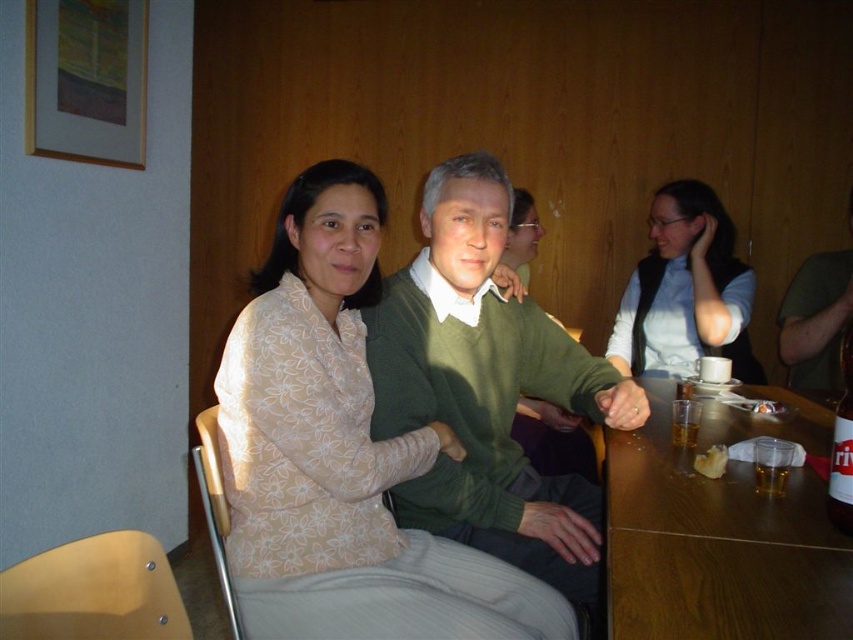
You are a photographer setting up for a group photo. You need to ensure that the green sweater at center and the white matte vest at upper right are both visible in the frame. Considering their sizes, which one might require more space horizontally to fit comfortably?

The green sweater at center requires more horizontal space because its width surpasses that of the white matte vest at upper right.

You are a photographer adjusting your camera settings to capture the scene. You notice the green sweater at center and the white matte vest at upper right. Which object should you focus on first to ensure both are in sharp focus?

The green sweater at center should be focused on first since it is in front of the white matte vest at upper right, allowing the photographer to adjust focus starting from the nearest subject.